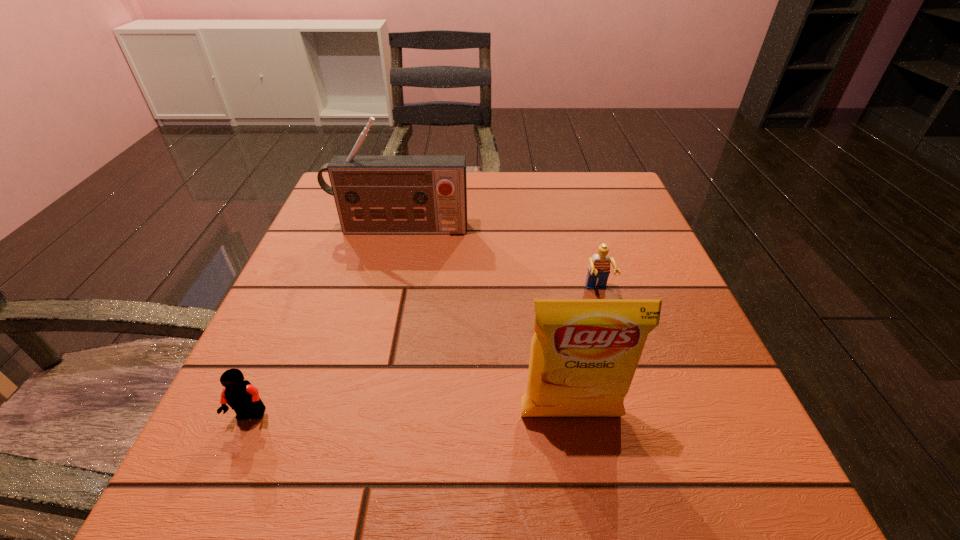
Identify the location of the farthest object. Image resolution: width=960 pixels, height=540 pixels. (373, 194).

The width and height of the screenshot is (960, 540). Find the location of `crisp (potato chip)`. crisp (potato chip) is located at coordinates (584, 353).

This screenshot has width=960, height=540. Find the location of `the second farthest object`. the second farthest object is located at coordinates (598, 272).

The image size is (960, 540). Find the location of `the farther Lego`. the farther Lego is located at coordinates (598, 272).

The image size is (960, 540). Find the location of `the left Lego`. the left Lego is located at coordinates (243, 397).

Find the location of `vacant space positioned 0.180m on the front panel of the farthest object`. vacant space positioned 0.180m on the front panel of the farthest object is located at coordinates (383, 295).

Identify the location of vacant area located 0.100m on the front of the crisp (potato chip) with the logo. (587, 510).

Where is `free space located on the face of the third nearest object`? free space located on the face of the third nearest object is located at coordinates (613, 348).

The image size is (960, 540). What are the coordinates of `free region located 0.080m on the front-facing side of the left Lego` in the screenshot? It's located at (221, 487).

Locate an element on the screen. The image size is (960, 540). object that is at the far edge is located at coordinates (373, 194).